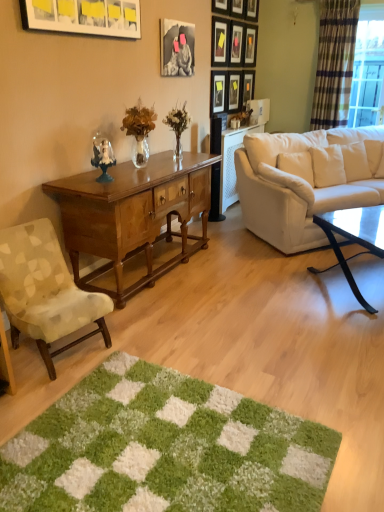
Locate an element on the screen. The image size is (384, 512). free space to the left of black metal coffee table at lower right is located at coordinates (289, 292).